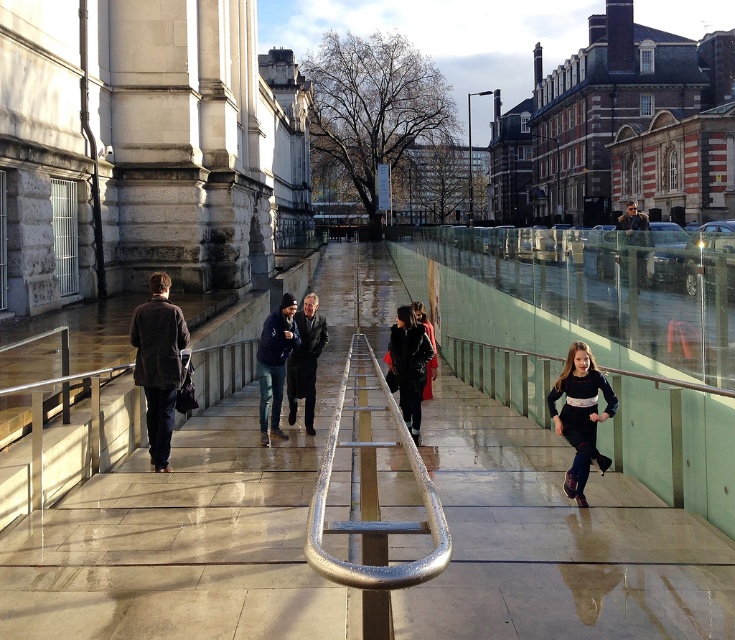
You are a delivery robot that is 1.2 meters wide. You need to move from the silver metallic rail at center to the brown leather jacket at left. Is there enough space for you to pass through the gap between them?

The distance between the silver metallic rail at center and the brown leather jacket at left is 2.82 meters. Since the robot is 1.2 meters wide, there is sufficient space for it to pass through the gap between them.

You are standing on the wet pedestrian bridge and see the brown leather jacket at left and the dark brown leather coat at center. Which person is closer to you?

The brown leather jacket at left is closer to you because it is in front of the dark brown leather coat at center.

You are standing on the wet pedestrian bridge and notice a silver metallic rail at center and a brown leather jacket at left. Which object is positioned to the right of the other?

The silver metallic rail at center is to the right of the brown leather jacket at left.